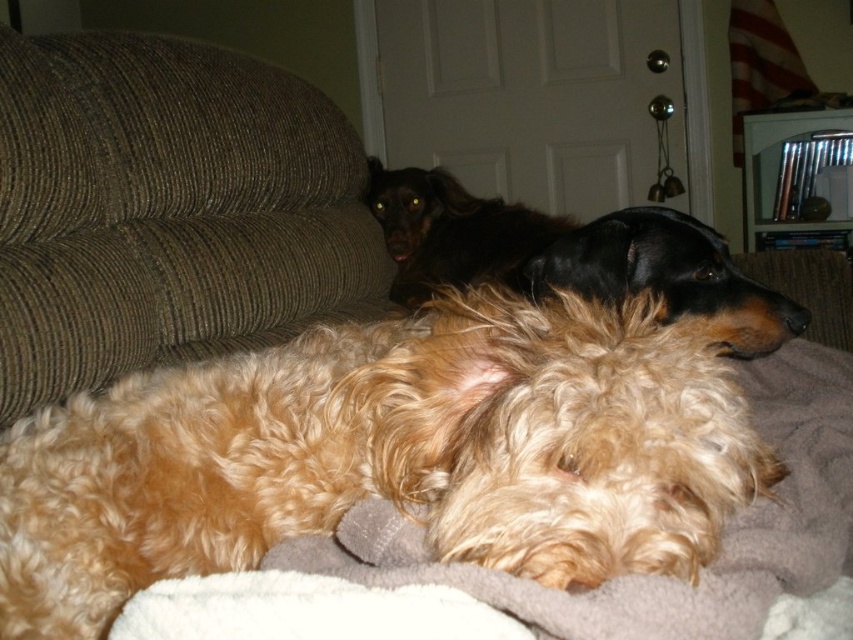
Looking at this image, you are a photographer setting up a shoot in this living room. You need to position a large tripod between the golden curly fur dog at center and the brown corduroy couch at upper left. Based on their positions, will the tripod be placed in front of the couch or behind the dog?

The golden curly fur dog at center is in front of the brown corduroy couch at upper left, so placing the tripod between them would mean it is positioned behind the dog and in front of the couch.

You are a dog owner who wants to place a new dog bed on the couch. The bed requires 1.2 meters of space. Given the sizes of the brown corduroy couch at upper left and the shiny black coat at upper center, can you fit the bed on either of them?

The brown corduroy couch at upper left has a smaller size compared to shiny black coat at upper center. Therefore, the bed may fit on the shiny black coat at upper center if it has enough space, but the brown corduroy couch at upper left is too small.

You are a photographer setting up a camera to capture both dogs in the scene. The camera has a focus range of 36 inches. Can you focus on both the golden curly fur dog at center and the black fur at center simultaneously?

The golden curly fur dog at center is 36.16 inches away from black fur at center. Since the distance between them is slightly over 36 inches, the camera might not be able to focus on both dogs at the same time.